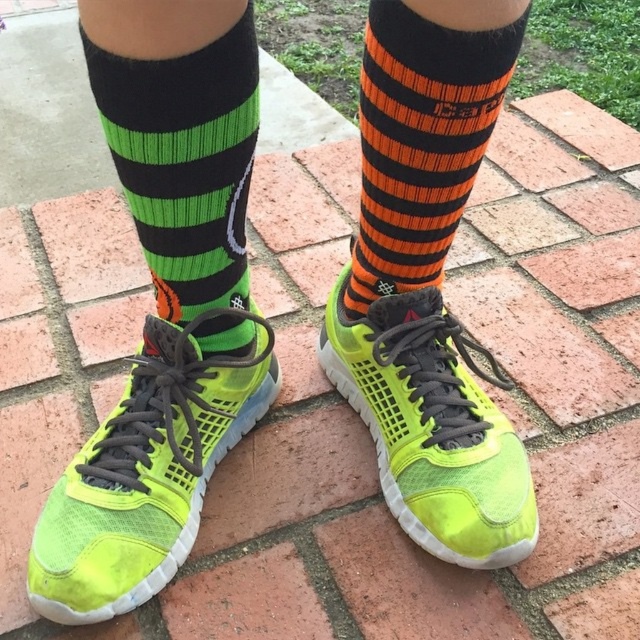
You are a photographer trying to capture the neon green shoes and their colorful socks in the image. The coordinates of the green knitted sock at left are given as point (184, 161). Based on this information, can you determine which sock is positioned to the left?

The green knitted sock at left is represented by point (184, 161), so the sock at this coordinate is the one positioned to the left.

You are a photographer trying to capture a detailed shot of the socks. You want to focus on the green knitted sock at left and orange striped sock at upper right. Based on their positions, which sock should you adjust your camera to focus on first if you start from the left side?

The green knitted sock at left should be focused on first since it is positioned to the left of the orange striped sock at upper right.